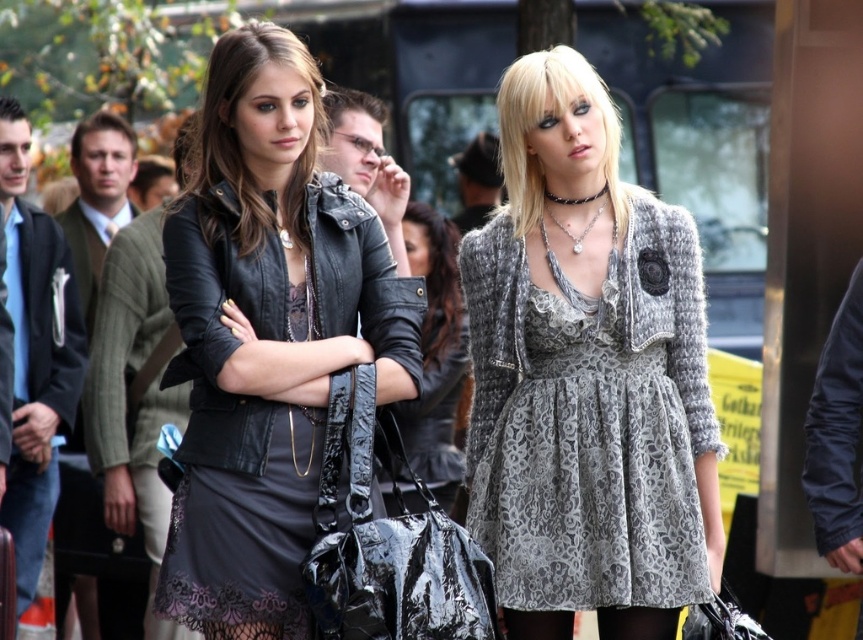
Can you confirm if black leather jacket at center is positioned below gray lace dress at center?

No.

This screenshot has width=863, height=640. What do you see at coordinates (268, 337) in the screenshot?
I see `black leather jacket at center` at bounding box center [268, 337].

Identify the location of black leather jacket at center. (268, 337).

Does gray lace dress at center appear on the left side of leather jacket at center?

In fact, gray lace dress at center is to the right of leather jacket at center.

Between point (602, 556) and point (439, 292), which one is positioned in front?

Positioned in front is point (602, 556).

This screenshot has height=640, width=863. What do you see at coordinates (590, 419) in the screenshot?
I see `gray lace dress at center` at bounding box center [590, 419].

At what (x,y) coordinates should I click in order to perform the action: click on gray lace dress at center. Please return your answer as a coordinate pair (x, y). Looking at the image, I should click on (590, 419).

Looking at this image, can you confirm if black leather jacket at center is positioned to the right of leather jacket at center?

No, black leather jacket at center is not to the right of leather jacket at center.

How distant is black leather jacket at center from leather jacket at center?

The distance of black leather jacket at center from leather jacket at center is 14.92 feet.

Describe the element at coordinates (268, 337) in the screenshot. The width and height of the screenshot is (863, 640). I see `black leather jacket at center` at that location.

At what (x,y) coordinates should I click in order to perform the action: click on black leather jacket at center. Please return your answer as a coordinate pair (x, y). This screenshot has height=640, width=863. Looking at the image, I should click on (268, 337).